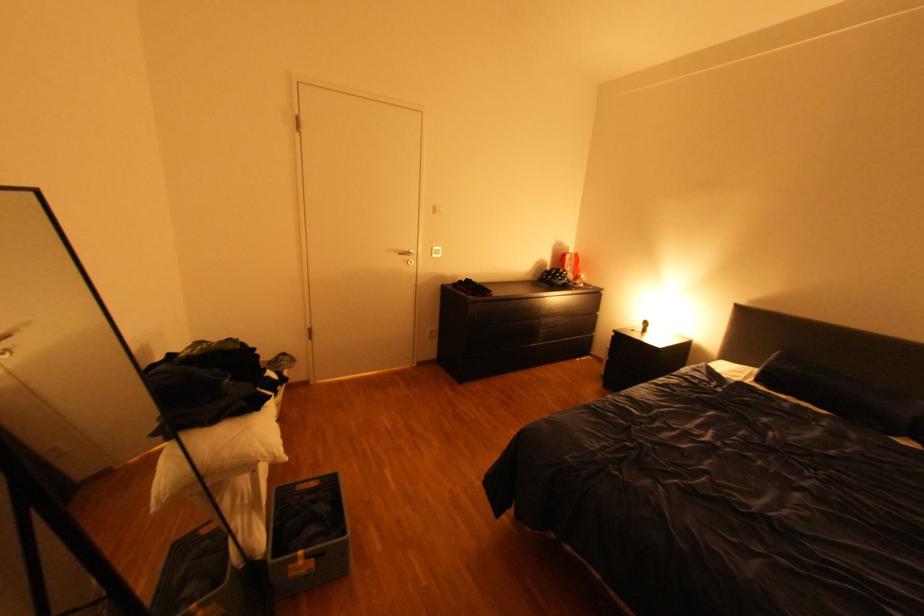
Describe the element at coordinates (407, 254) in the screenshot. I see `the metal door handle` at that location.